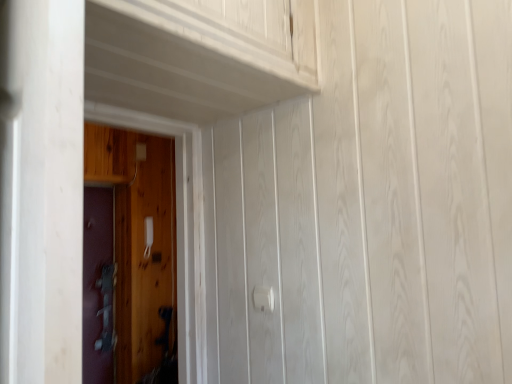
Question: From a real-world perspective, is wooden door at left, the 1th door viewed from the right, physically below metallic gray door at left, which is counted as the 2th door, starting from the front?

Choices:
 (A) no
 (B) yes

Answer: (A)

Question: Does wooden door at left, which is counted as the first door, starting from the front, have a smaller size compared to metallic gray door at left, the 2th door positioned from the right?

Choices:
 (A) no
 (B) yes

Answer: (A)

Question: Considering the relative positions of wooden door at left, the 1th door viewed from the right, and metallic gray door at left, which is counted as the 2th door, starting from the front, in the image provided, is wooden door at left, the 1th door viewed from the right, to the right of metallic gray door at left, which is counted as the 2th door, starting from the front, from the viewer's perspective?

Choices:
 (A) no
 (B) yes

Answer: (B)

Question: Could you tell me if wooden door at left, which is counted as the first door, starting from the front, is turned towards metallic gray door at left, the first door viewed from the left?

Choices:
 (A) no
 (B) yes

Answer: (A)

Question: Can you confirm if wooden door at left, the 2th door in the left-to-right sequence, is bigger than metallic gray door at left, the 2th door positioned from the right?

Choices:
 (A) no
 (B) yes

Answer: (B)

Question: Is white plastic door handle at center in front of or behind wooden door at left, marked as the second door in a back-to-front arrangement, in the image?

Choices:
 (A) behind
 (B) front

Answer: (A)

Question: Looking at their shapes, would you say white plastic door handle at center is wider or thinner than wooden door at left, marked as the second door in a back-to-front arrangement?

Choices:
 (A) wide
 (B) thin

Answer: (B)

Question: From a real-world perspective, is white plastic door handle at center positioned above or below wooden door at left, which is counted as the first door, starting from the front?

Choices:
 (A) above
 (B) below

Answer: (B)

Question: Considering the positions of white plastic door handle at center and wooden door at left, the 1th door viewed from the right, in the image, is white plastic door handle at center taller or shorter than wooden door at left, the 1th door viewed from the right,?

Choices:
 (A) tall
 (B) short

Answer: (B)

Question: Considering their positions, is metallic gray door at left, the 2th door positioned from the right, located in front of or behind white plastic door handle at center?

Choices:
 (A) behind
 (B) front

Answer: (A)

Question: From their relative heights in the image, would you say metallic gray door at left, the 2th door positioned from the right, is taller or shorter than white plastic door handle at center?

Choices:
 (A) short
 (B) tall

Answer: (B)

Question: From the image's perspective, is metallic gray door at left, the 2th door positioned from the right, located above or below white plastic door handle at center?

Choices:
 (A) below
 (B) above

Answer: (A)

Question: Is metallic gray door at left, which is counted as the 2th door, starting from the front, bigger or smaller than white plastic door handle at center?

Choices:
 (A) small
 (B) big

Answer: (B)

Question: From the image's perspective, relative to wooden door at left, which is counted as the first door, starting from the front, is metallic gray door at left, acting as the 1th door starting from the back, above or below?

Choices:
 (A) below
 (B) above

Answer: (A)

Question: In terms of size, does metallic gray door at left, the 2th door positioned from the right, appear bigger or smaller than wooden door at left, which is counted as the first door, starting from the front?

Choices:
 (A) big
 (B) small

Answer: (B)